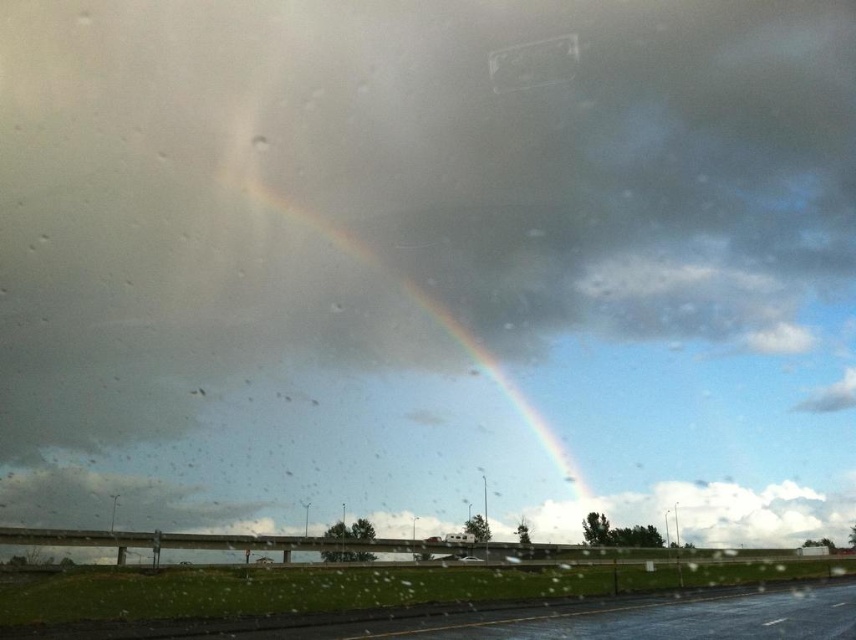
You are a passenger in a car and notice the glossy asphalt highway at lower center and the rainbow at upper center through the rain splattered windshield. Which object is positioned to the right side from your perspective?

The glossy asphalt highway at lower center is positioned to the right of the rainbow at upper center.

You are driving a car and see the rainbow at upper center and the white glossy car at center through the rain. Which object is closer to your eyes?

The rainbow at upper center is further to the viewer than the white glossy car at center, so the white glossy car at center is closer to your eyes.

You are driving a car and see the rainbow at upper center and the white glossy car at center through the rain. Which object is higher in the image?

The rainbow at upper center is higher than the white glossy car at center in the image.